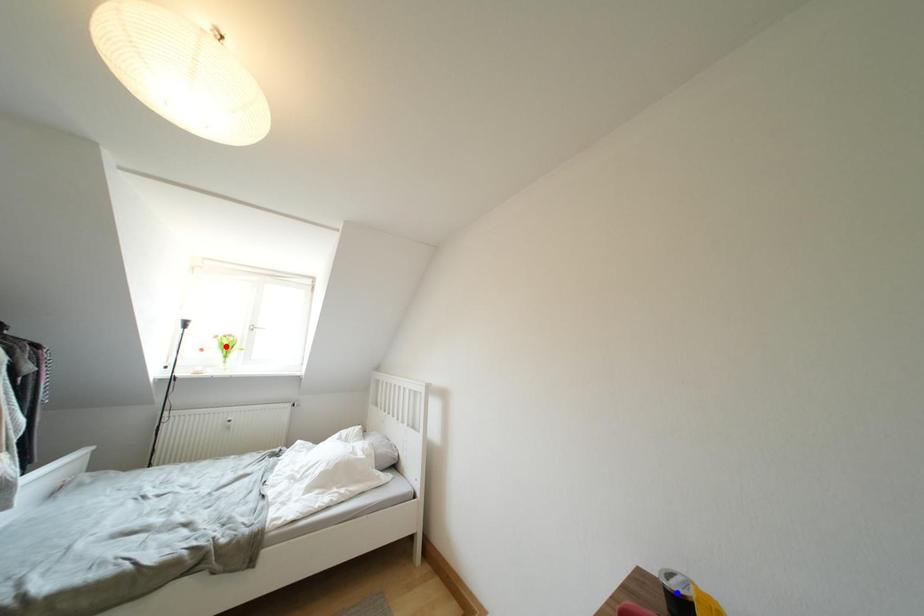
Question: Which of the two points in the image is closer to the camera?

Choices:
 (A) Blue point is closer.
 (B) Red point is closer.

Answer: (A)